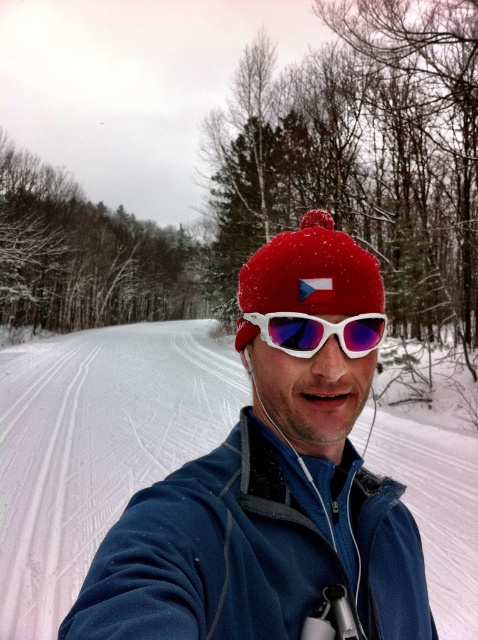
Image resolution: width=478 pixels, height=640 pixels. In order to click on red knitted hat at center in this screenshot , I will do `click(312, 273)`.

Locate an element on the screen. The image size is (478, 640). red knitted hat at center is located at coordinates (312, 273).

Is blue fleece jacket at center behind red knitted hat at center?

No, blue fleece jacket at center is in front of red knitted hat at center.

Can you confirm if blue fleece jacket at center is shorter than red knitted hat at center?

In fact, blue fleece jacket at center may be taller than red knitted hat at center.

Is point (144, 573) behind point (338, 240)?

No.

The height and width of the screenshot is (640, 478). In order to click on blue fleece jacket at center in this screenshot , I will do `click(254, 552)`.

Who is higher up, blue fleece jacket at center or white matte/glossy goggles at center?

Positioned higher is white matte/glossy goggles at center.

Who is shorter, blue fleece jacket at center or white matte/glossy goggles at center?

Standing shorter between the two is white matte/glossy goggles at center.

Identify the location of blue fleece jacket at center. This screenshot has width=478, height=640. (254, 552).